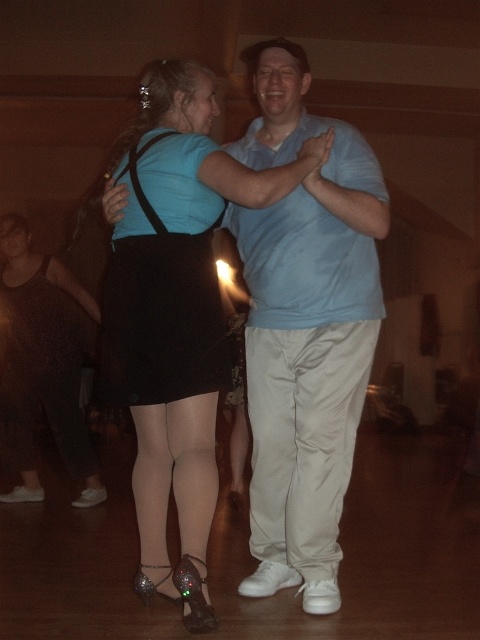
Does light blue cotton shirt at center appear under matte black skirt at left?

Incorrect, light blue cotton shirt at center is not positioned below matte black skirt at left.

Which is more to the right, light blue cotton shirt at center or matte black skirt at left?

light blue cotton shirt at center

Is point (333, 154) closer to viewer compared to point (68, 289)?

Yes, point (333, 154) is in front of point (68, 289).

Where is `light blue cotton shirt at center`? The height and width of the screenshot is (640, 480). light blue cotton shirt at center is located at coordinates (304, 330).

The image size is (480, 640). What do you see at coordinates (163, 284) in the screenshot?
I see `black satin skirt at center` at bounding box center [163, 284].

Where is `black satin skirt at center`? black satin skirt at center is located at coordinates (163, 284).

Locate an element on the screen. black satin skirt at center is located at coordinates (163, 284).

Where is `black satin skirt at center`? This screenshot has width=480, height=640. black satin skirt at center is located at coordinates (163, 284).

Does matte black skirt at center appear on the right side of matte black skirt at left?

Correct, you'll find matte black skirt at center to the right of matte black skirt at left.

Where is `matte black skirt at center`? matte black skirt at center is located at coordinates (183, 172).